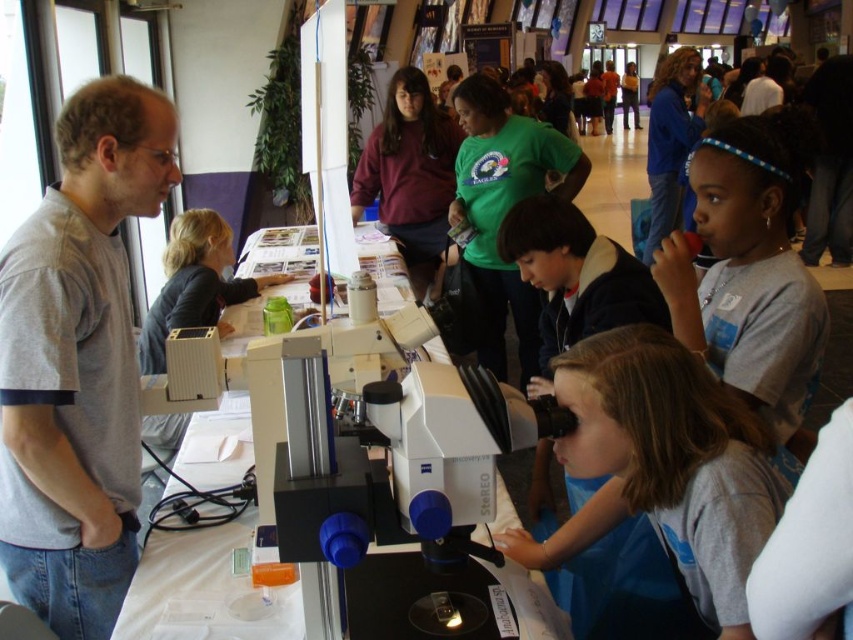
You are a student at the science fair and need to reach the white plastic microscope at center to examine a slide. However, there is a gray cotton shirt at left in your way. Based on their positions, can you move around the shirt to access the microscope?

The gray cotton shirt at left is positioned on the left side of the white plastic microscope at center, so you can move around to the right side of the shirt to access the microscope.

Consider the image. You are a student participating in a science fair and need to place a 12 inch ruler between the white plastic microscope at center and the light brown hair at center. Can you fit the ruler between them without overlapping either object?

The white plastic microscope at center is 10.83 inches from the light brown hair at center. Since the ruler is 12 inches long, it cannot fit between them without overlapping either object because the distance is shorter than the ruler.

What is the color of the object located at point (78,362)?

The object at point (78,362) is a gray cotton shirt at left.